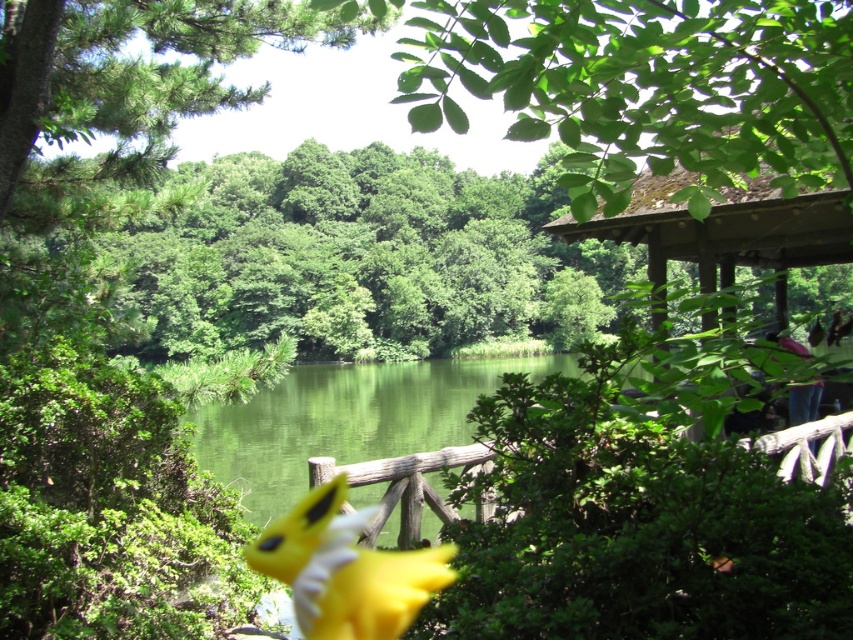
Question: Which object appears farthest from the camera in this image?

Choices:
 (A) yellow plush toy at center
 (B) green leafy tree at upper left

Answer: (A)

Question: Can you confirm if green leafy tree at upper left is smaller than yellow plush toy at center?

Choices:
 (A) no
 (B) yes

Answer: (A)

Question: Is green leafy tree at upper left to the right of yellow plush toy at center from the viewer's perspective?

Choices:
 (A) yes
 (B) no

Answer: (B)

Question: Among these objects, which one is nearest to the camera?

Choices:
 (A) yellow plush toy at center
 (B) green leafy tree at upper left

Answer: (B)

Question: Can you confirm if green leafy tree at upper left is bigger than yellow plush toy at center?

Choices:
 (A) yes
 (B) no

Answer: (A)